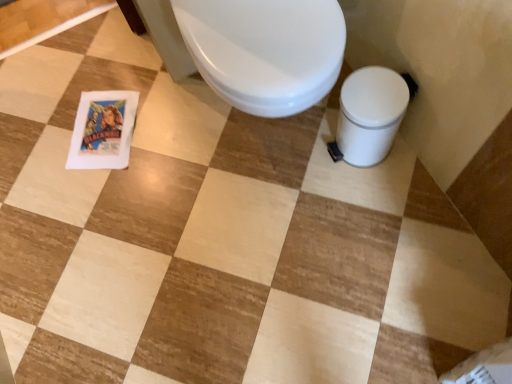
Question: Should I look upward or downward to see white glossy toilet bowl at lower right?

Choices:
 (A) up
 (B) down

Answer: (A)